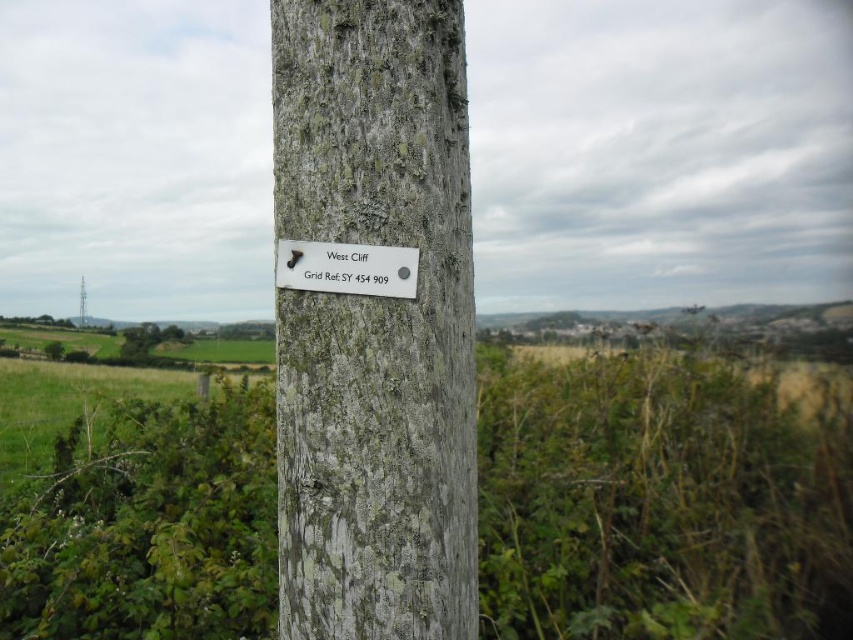
You are holding a camera and want to take a photo of the white plastic sign at center. If you move 0.5 meters closer to the sign, will the sign appear larger in the photo?

The white plastic sign at center and camera are 1.39 meters apart. Moving 0.5 meters closer would reduce the distance to 0.89 meters, making the sign appear larger in the photo.